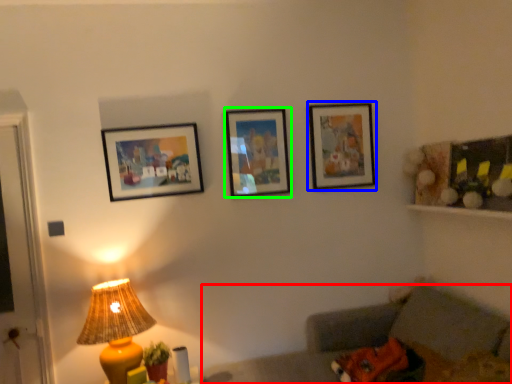
Question: Which object is positioned closest to couch (highlighted by a red box)? Select from picture frame (highlighted by a blue box) and picture frame (highlighted by a green box).

Choices:
 (A) picture frame
 (B) picture frame

Answer: (A)